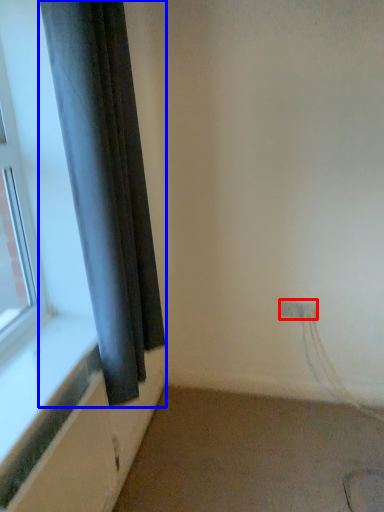
Question: Among these objects, which one is nearest to the camera, electric outlet (highlighted by a red box) or curtain (highlighted by a blue box)?

Choices:
 (A) electric outlet
 (B) curtain

Answer: (B)